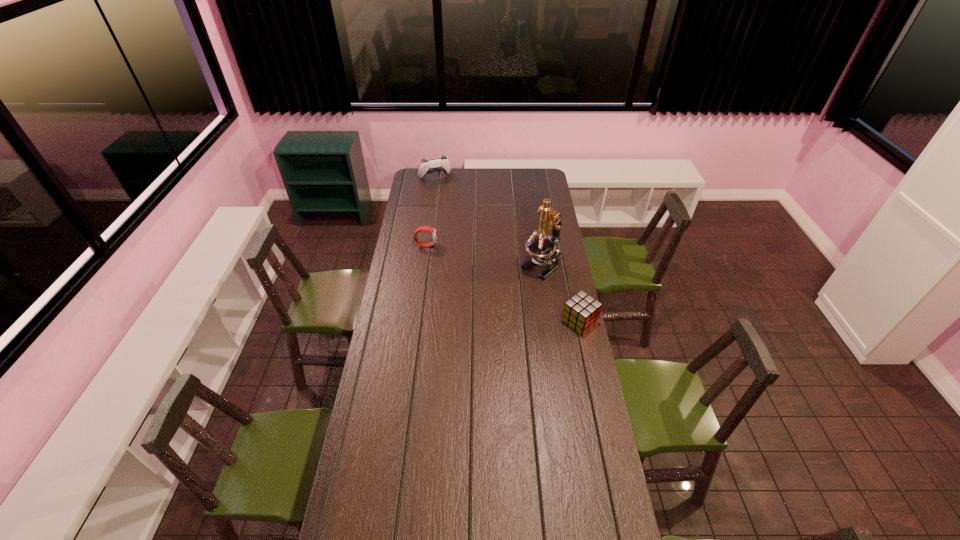
Locate an element on the screen. Image resolution: width=960 pixels, height=540 pixels. the third nearest object is located at coordinates [425, 228].

The height and width of the screenshot is (540, 960). I want to click on cube, so (581, 312).

You are a GUI agent. You are given a task and a screenshot of the screen. Output one action in this format:
    pyautogui.click(x=<x>, y=<y>)
    Task: Click on the second nearest object
    The image size is (960, 540).
    Given the screenshot: What is the action you would take?
    542,248

The height and width of the screenshot is (540, 960). I want to click on the tallest object, so click(x=542, y=248).

Where is `the farthest object`? the farthest object is located at coordinates (441, 164).

Find the location of a particular element. The image size is (960, 540). free spot located 0.190m on the face of the second farthest object is located at coordinates (472, 245).

Identify the location of free location located on the back of the nearest object. (572, 287).

Image resolution: width=960 pixels, height=540 pixels. What are the coordinates of `free space located at the eyepiece of the microscope` in the screenshot? It's located at (482, 316).

Identify the location of free space located 0.110m at the eyepiece of the microscope. Image resolution: width=960 pixels, height=540 pixels. (516, 288).

You are a GUI agent. You are given a task and a screenshot of the screen. Output one action in this format:
    pyautogui.click(x=<x>, y=<y>)
    Task: Click on the free region located at the eyepiece of the microscope
    This screenshot has width=960, height=540.
    Given the screenshot: What is the action you would take?
    pyautogui.click(x=500, y=301)